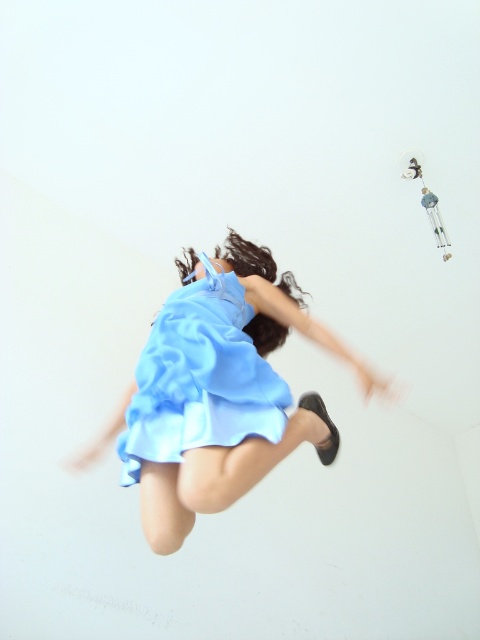
You are an assistant helping a customer choose between two dresses displayed in the store. The customer is standing in front of the dresses and wants to know which one is taller. The dresses are the light blue fabric dress at center and the matte blue dress at center. Which dress is taller?

The light blue fabric dress at center is taller than the matte blue dress at center.

Looking at this image, you are an assistant helping someone choose between two dresses displayed in the image. The dresses are the light blue fabric dress at center and the matte blue dress at center. Based on their appearance, which dress would you recommend if the person wants something that appears more voluminous?

The light blue fabric dress at center might be wider than matte blue dress at center, so it would be the better choice for someone seeking a more voluminous look.